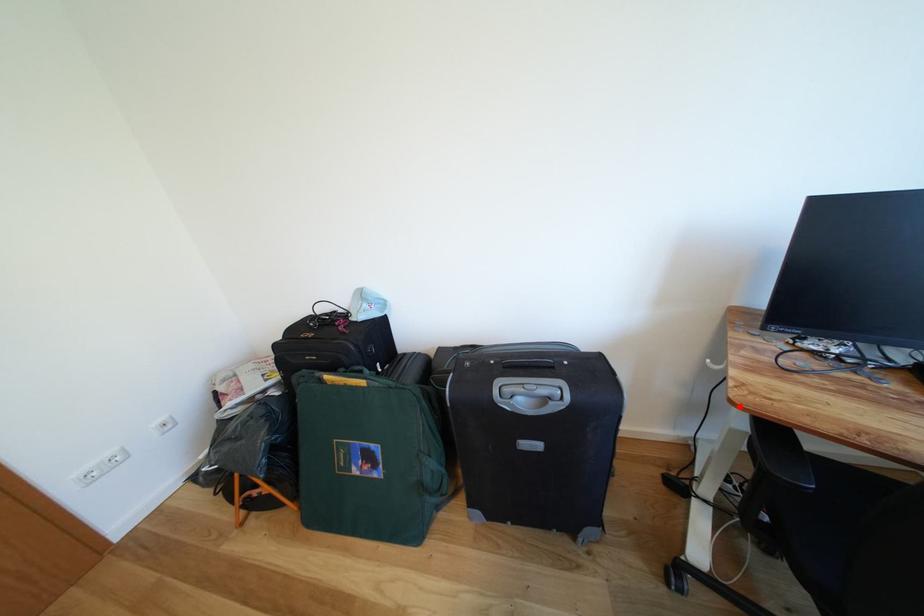
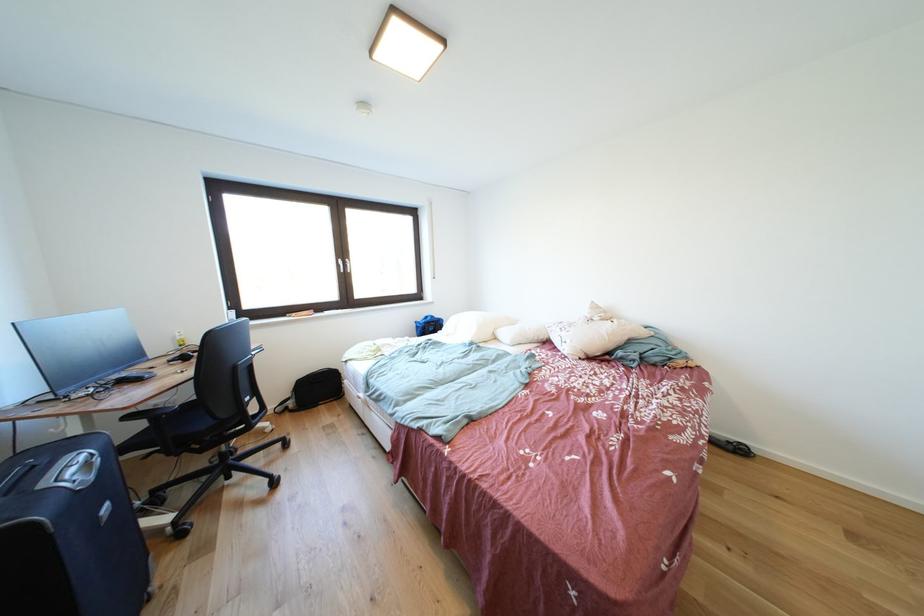
Find the pixel in the second image that matches the highlighted location in the first image.

(134, 413)